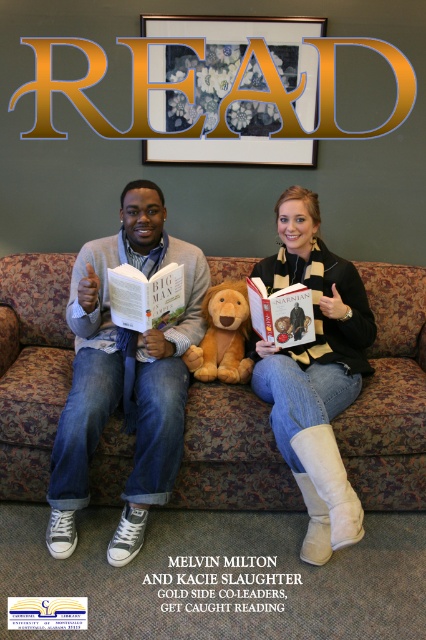
Question: Is white suede boots at lower right below brown plush teddy bear at center?

Choices:
 (A) yes
 (B) no

Answer: (A)

Question: Is brown fabric couch at center bigger than hardcover book at center?

Choices:
 (A) yes
 (B) no

Answer: (A)

Question: Is white suede boots at lower right to the right of white paper book at center from the viewer's perspective?

Choices:
 (A) yes
 (B) no

Answer: (A)

Question: Which object is positioned closest to the brown plush teddy bear at center?

Choices:
 (A) white paper book at center
 (B) hardcover book at center
 (C) white paper at center
 (D) matte gray sweater at center

Answer: (B)

Question: Which point is closer to the camera?

Choices:
 (A) (236, 358)
 (B) (278, 305)
 (C) (71, 547)

Answer: (C)

Question: Which object is closer to the camera taking this photo?

Choices:
 (A) brown plush teddy bear at center
 (B) white paper at center
 (C) hardcover book at center

Answer: (B)